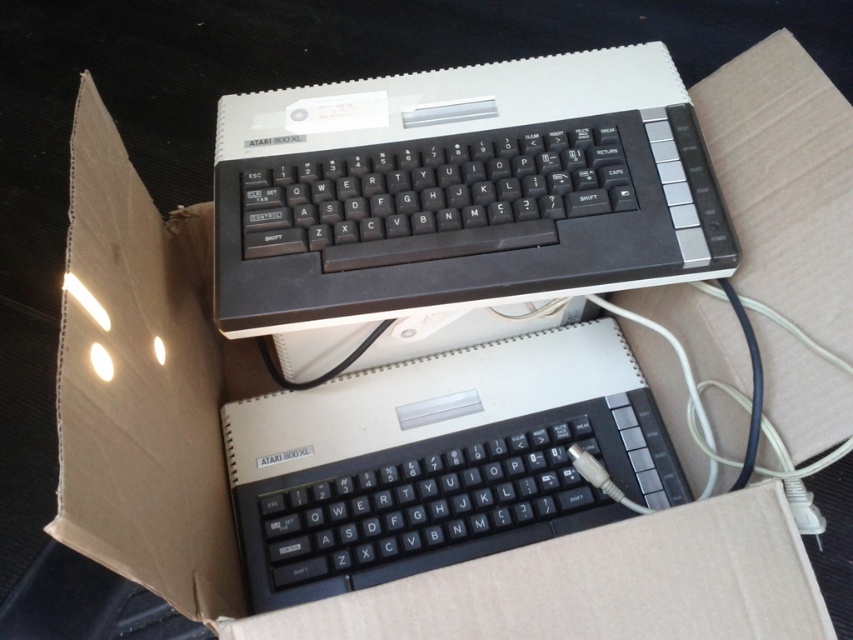
You are packing a vintage Atari 800 XL computer into a cardboard box. The computer has a black plastic keyboard at upper center. Where should you place the keyboard to ensure it fits properly within the box?

The black plastic keyboard at upper center should be placed at point (461, 189) to ensure it fits properly within the box.

You are packing a vintage computer collection and need to determine the placement of two keyboards inside a box. You have the black plastic keyboard at upper center and the black plastic keyboard at center. Which keyboard is positioned closer to the front of the box?

The black plastic keyboard at upper center is closer to the viewer than the black plastic keyboard at center, so it is positioned closer to the front of the box.

You are packing a box with two vintage Atari 800 XL computers. You need to place a label on the box at a position that is closer to the front of the box. Which of the two points, point (606, 97) or point (426, 388), should you choose?

Point (606, 97) is in front of point (426, 388), so you should choose point (606, 97) to place the label closer to the front of the box.